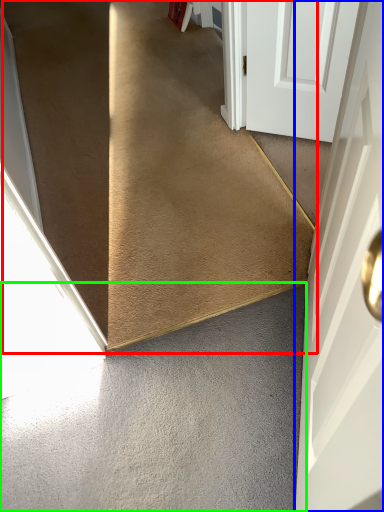
Question: Which object is positioned closest to stairs (highlighted by a red box)? Select from door (highlighted by a blue box) and concrete (highlighted by a green box).

Choices:
 (A) door
 (B) concrete

Answer: (B)